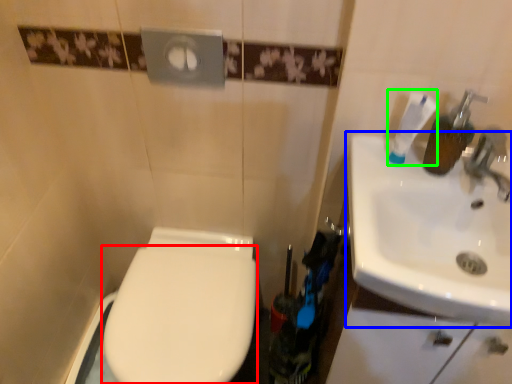
Question: Which is farther away from bidet (highlighted by a red box)? sink (highlighted by a blue box) or toothpaste (highlighted by a green box)?

Choices:
 (A) sink
 (B) toothpaste

Answer: (B)